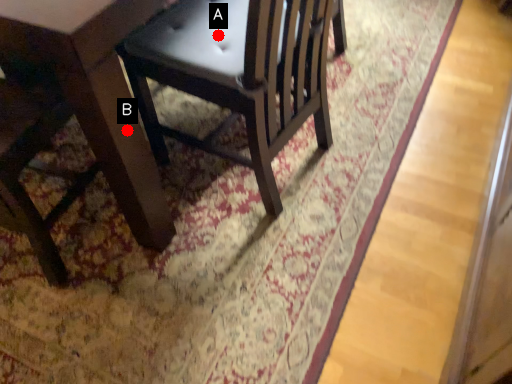
Question: Two points are circled on the image, labeled by A and B beside each circle. Which point is closer to the camera?

Choices:
 (A) A is closer
 (B) B is closer

Answer: (B)